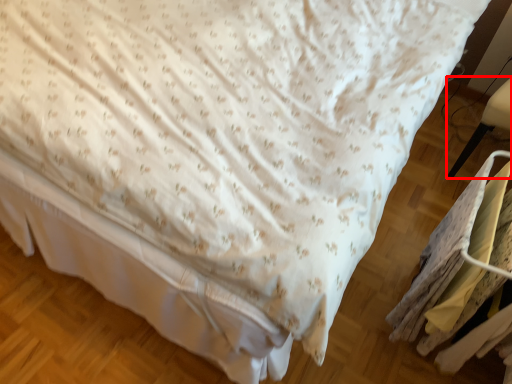
Question: From the image's perspective, what is the correct spatial relationship of furniture (annotated by the red box) in relation to laundry?

Choices:
 (A) above
 (B) below

Answer: (A)